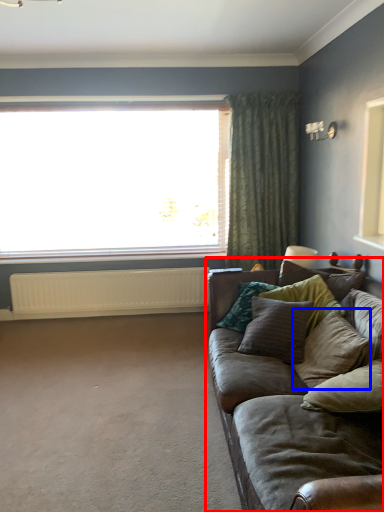
Question: Which object is closer to the camera taking this photo, studio couch (highlighted by a red box) or pillow (highlighted by a blue box)?

Choices:
 (A) studio couch
 (B) pillow

Answer: (A)